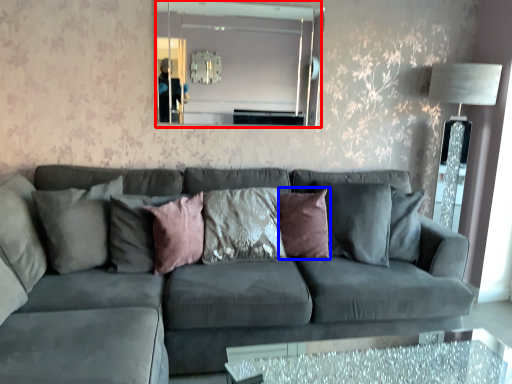
Question: Among these objects, which one is nearest to the camera, mirror (highlighted by a red box) or pillow (highlighted by a blue box)?

Choices:
 (A) mirror
 (B) pillow

Answer: (B)